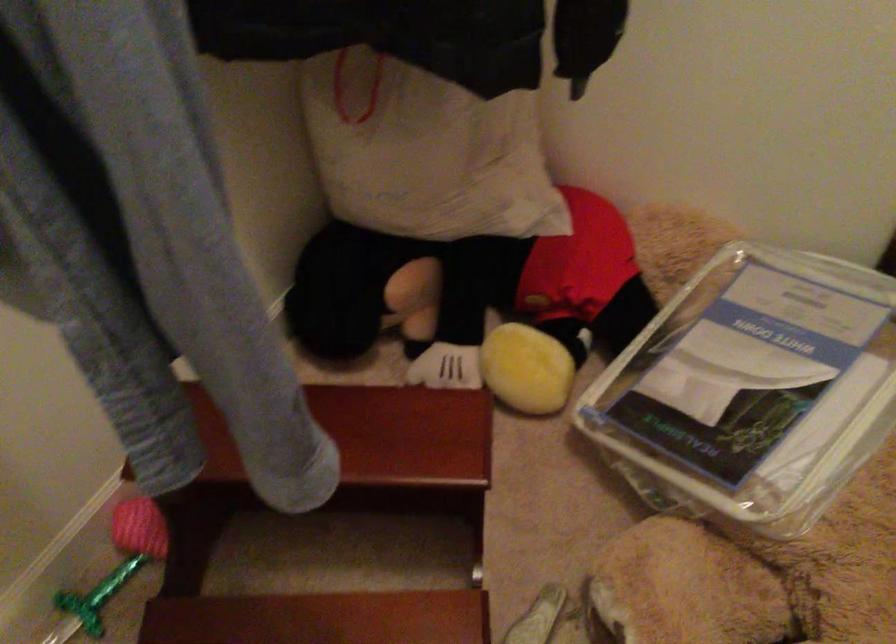
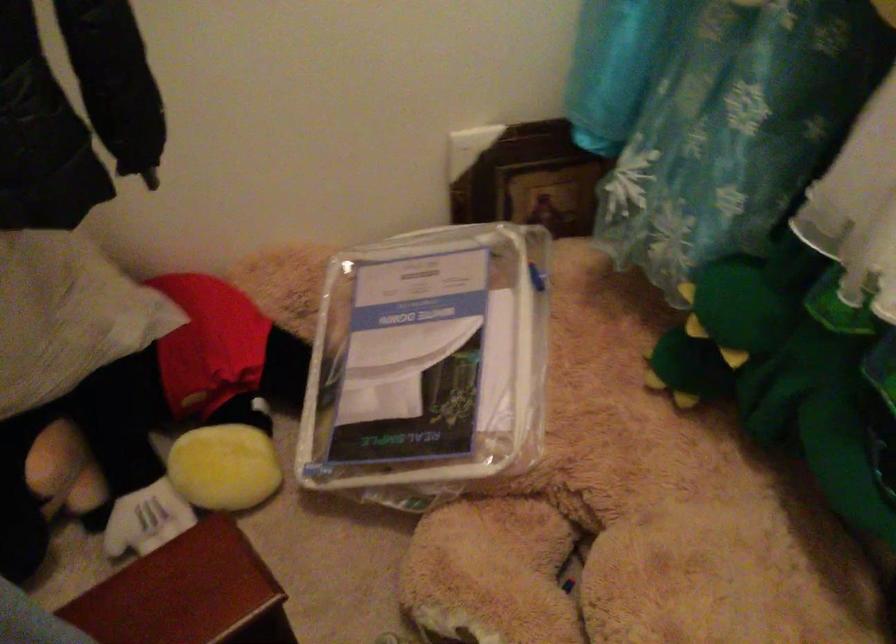
The point at (524,310) is marked in the first image. Where is the corresponding point in the second image?

(188, 415)